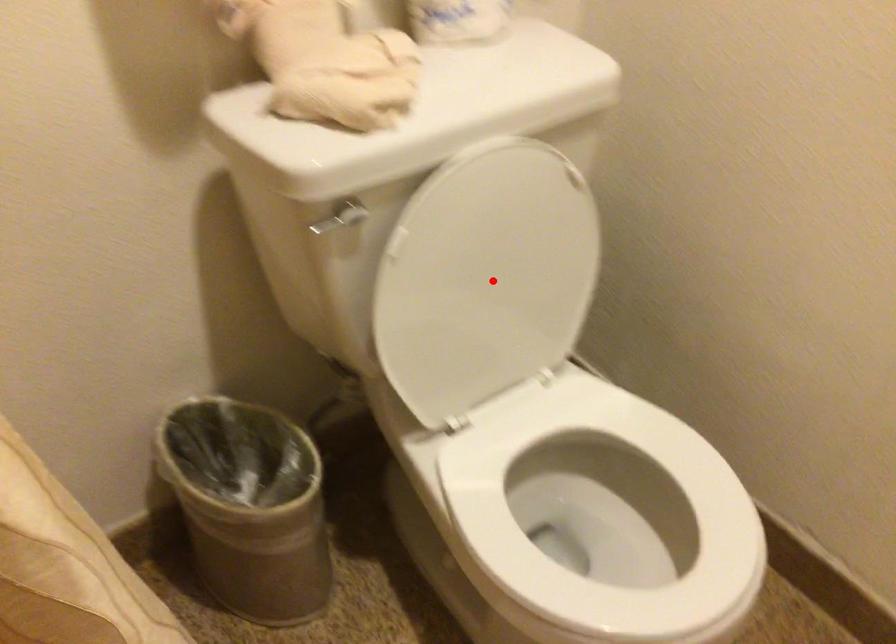
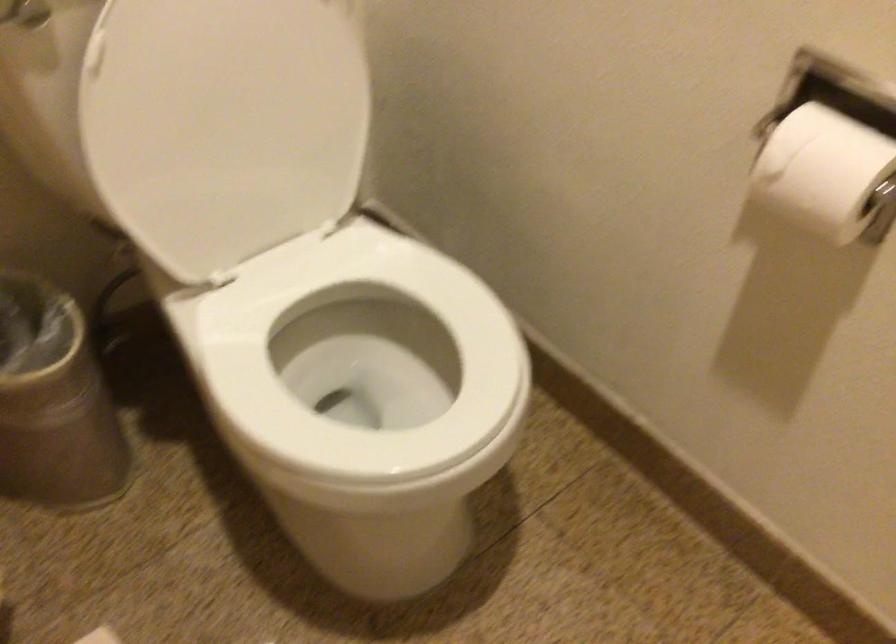
Question: I am providing you with two images of the same scene from different viewpoints. A red point is marked on the first image. Is the red point's position out of view in image 2?

Choices:
 (A) Yes
 (B) No

Answer: (B)